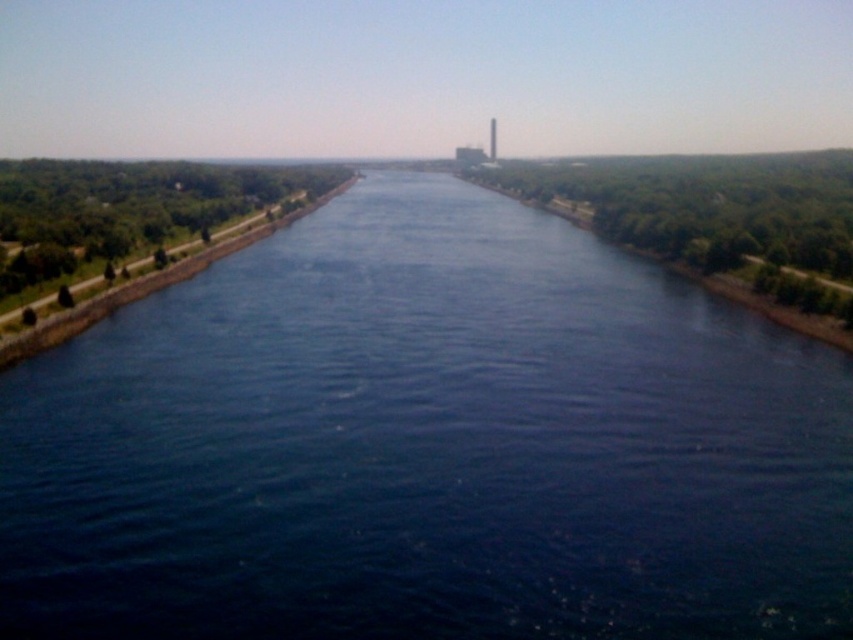
You are standing on the smooth gray tower at center and want to look down at the dark blue water at center. Can you see the water clearly from your current position?

The dark blue water at center has a lesser height compared to smooth gray tower at center, so yes, you can see the water clearly from your current position on the smooth gray tower at center.

You are standing on the smooth gray tower at center and want to observe the dark blue water at center. In which direction should you look to see it?

You should look downward because the dark blue water at center is below the smooth gray tower at center.